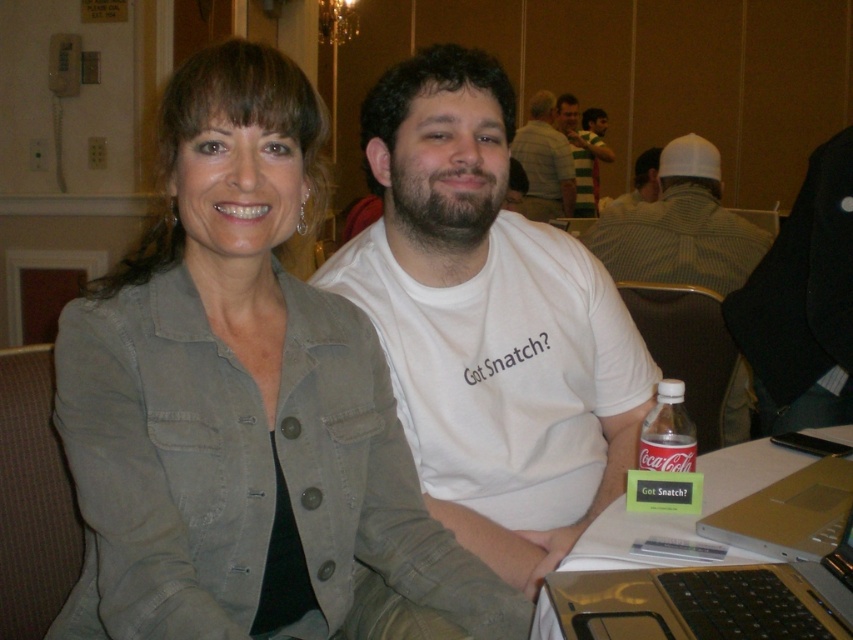
Does striped jersey at upper center come behind white cotton shirt at upper center?

Yes, striped jersey at upper center is further from the viewer.

Looking at this image, is striped jersey at upper center shorter than white cotton shirt at upper center?

No.

Which is in front, point (592, 196) or point (599, 205)?

Positioned in front is point (592, 196).

Locate an element on the screen. Image resolution: width=853 pixels, height=640 pixels. striped jersey at upper center is located at coordinates (581, 154).

Who is more distant from viewer, (213, 80) or (427, 481)?

Point (427, 481)

Locate an element on the screen. The image size is (853, 640). denim jacket at center is located at coordinates (241, 401).

Which is below, silver metallic laptop at lower right or white cotton shirt at upper center?

silver metallic laptop at lower right

Who is higher up, silver metallic laptop at lower right or white cotton shirt at upper center?

white cotton shirt at upper center is higher up.

The width and height of the screenshot is (853, 640). I want to click on silver metallic laptop at lower right, so click(x=788, y=513).